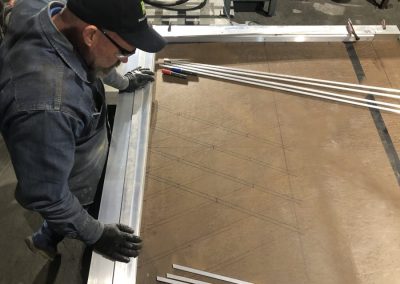
The image size is (400, 284). What are the coordinates of `table legs` in the screenshot? It's located at (x=268, y=8), (x=382, y=4).